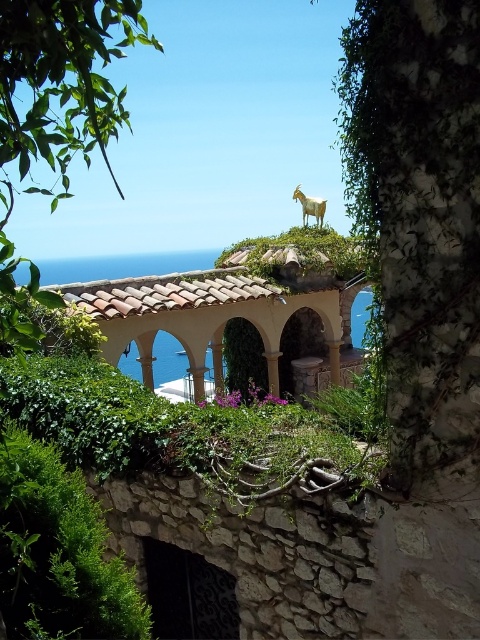
You are a gardener planning to water the green leafy plant at lower left and the golden metallic goat at upper center. Since you can only carry one watering can at a time, which object should you water first if you want to minimize the distance walked?

The green leafy plant at lower left should be watered first since it is to the left of the golden metallic goat at upper center, so watering them from left to right would minimize backtracking.

In the scene shown: You are a landscape designer planning to install a new pathway between the terracotta tiled gazebo at center and the golden metallic goat at upper center. The pathway requires a minimum of 10 feet of space. Based on the scene, is the current distance sufficient for your design?

The distance between the terracotta tiled gazebo at center and the golden metallic goat at upper center is 12.62 feet, which exceeds the required 10 feet. Therefore, the current distance is sufficient for the pathway.